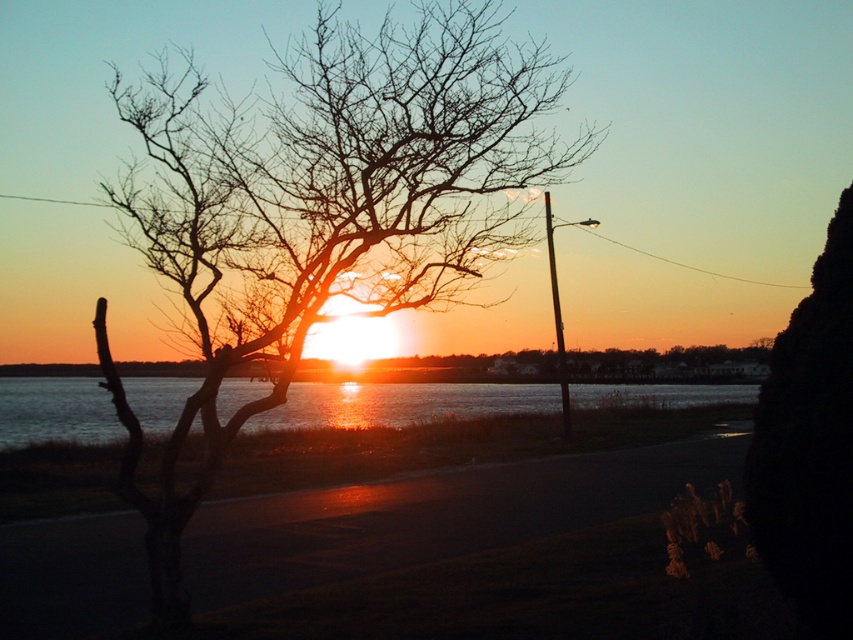
Question: Which of the following is the farthest from the observer?

Choices:
 (A) (70, 381)
 (B) (149, 220)

Answer: (A)

Question: Which point is closer to the camera taking this photo?

Choices:
 (A) (53, 412)
 (B) (144, 198)

Answer: (B)

Question: Is bare branches at left to the left of shiny reflective water at center from the viewer's perspective?

Choices:
 (A) no
 (B) yes

Answer: (B)

Question: Considering the relative positions of bare branches at left and shiny reflective water at center in the image provided, where is bare branches at left located with respect to shiny reflective water at center?

Choices:
 (A) left
 (B) right

Answer: (A)

Question: Does bare branches at left have a larger size compared to shiny reflective water at center?

Choices:
 (A) yes
 (B) no

Answer: (A)